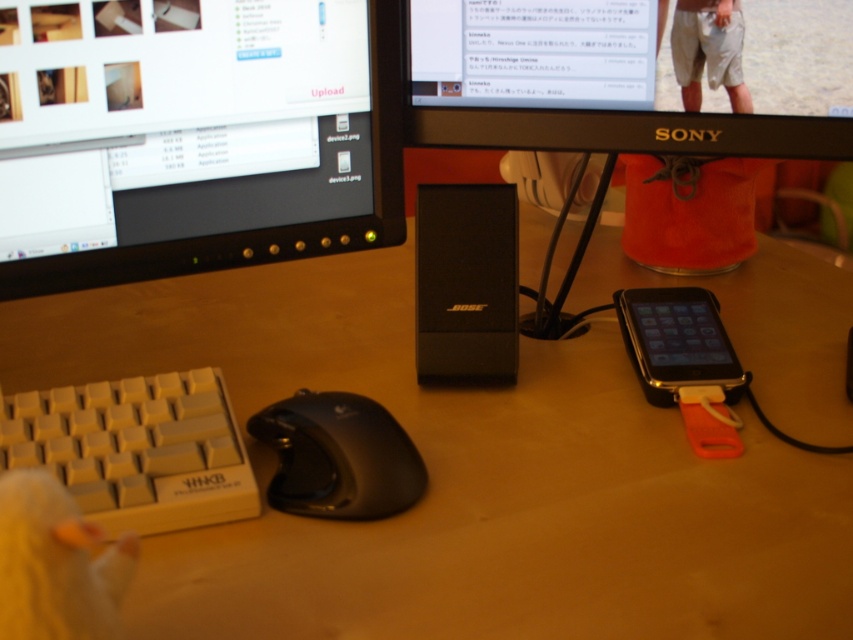
Question: Does black plastic speaker at center appear over white plastic keyboard at lower left?

Choices:
 (A) yes
 (B) no

Answer: (A)

Question: Is black plastic speaker at center wider than white plastic keyboard at lower left?

Choices:
 (A) no
 (B) yes

Answer: (B)

Question: Does wooden at center have a larger size compared to black glossy smartphone at lower right?

Choices:
 (A) yes
 (B) no

Answer: (A)

Question: Which point is farther from the camera taking this photo?

Choices:
 (A) (285, 502)
 (B) (215, 554)
 (C) (515, 26)

Answer: (C)

Question: Estimate the real-world distances between objects in this image. Which object is farther from the black glossy monitor at upper left?

Choices:
 (A) black plastic speaker at center
 (B) black plastic monitor at upper center
 (C) wooden at center
 (D) black matte mouse at lower center

Answer: (C)

Question: Among these objects, which one is farthest from the camera?

Choices:
 (A) wooden at center
 (B) black matte mouse at lower center

Answer: (B)